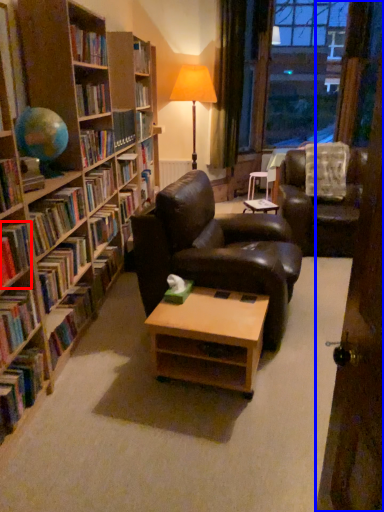
Question: Which object is closer to the camera taking this photo, book (highlighted by a red box) or door (highlighted by a blue box)?

Choices:
 (A) book
 (B) door

Answer: (B)